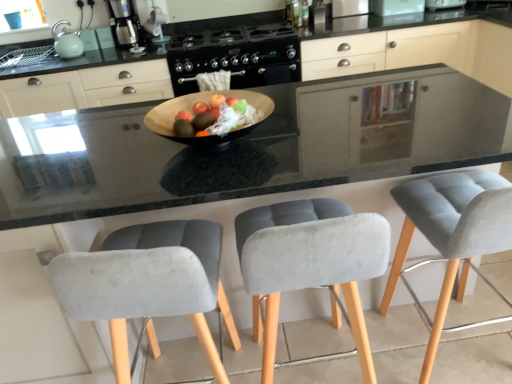
Locate an element on the screen. The height and width of the screenshot is (384, 512). free spot above velvet grey chair at center, positioned as the 2th chair in left-to-right order (from a real-world perspective) is located at coordinates (293, 167).